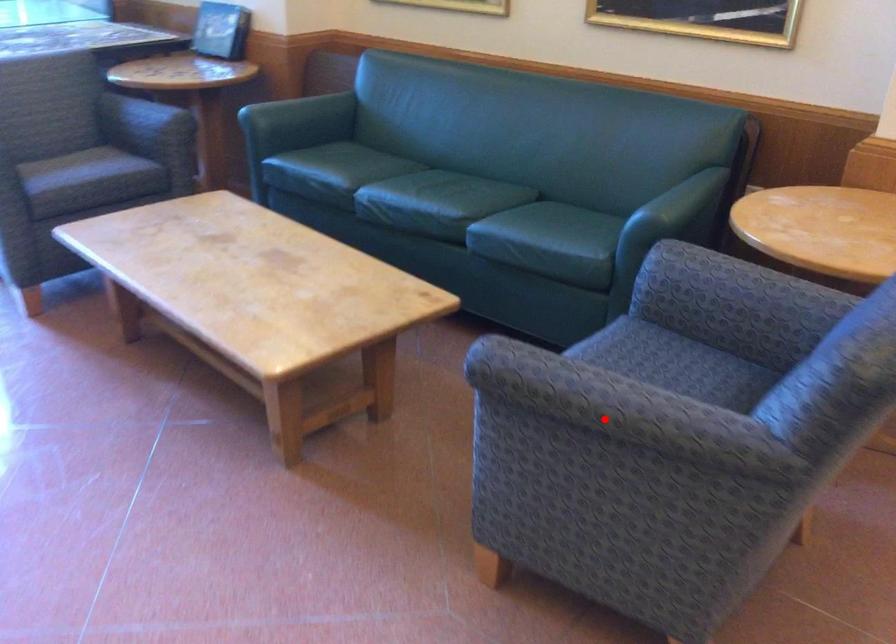
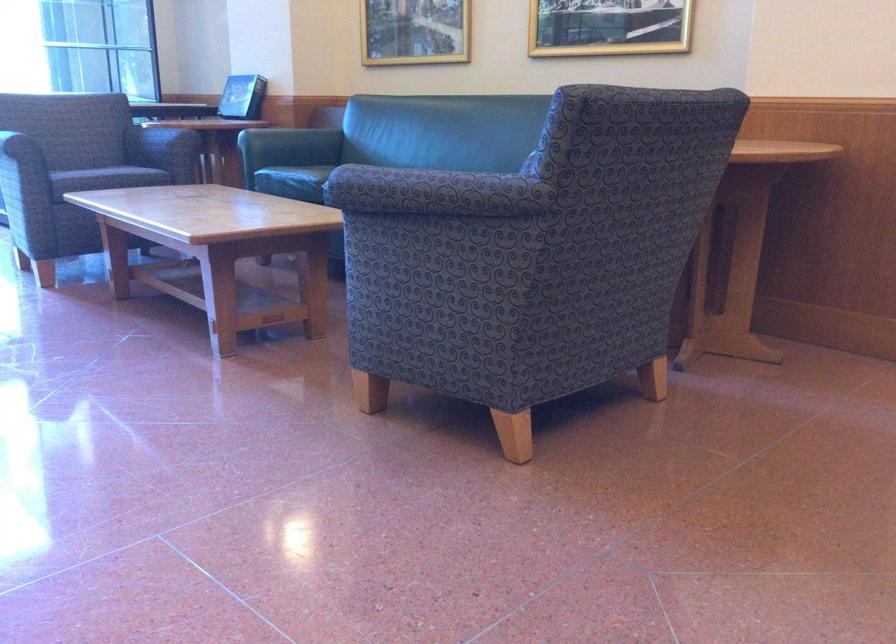
Locate, in the second image, the point that corresponds to the highlighted location in the first image.

(425, 192)